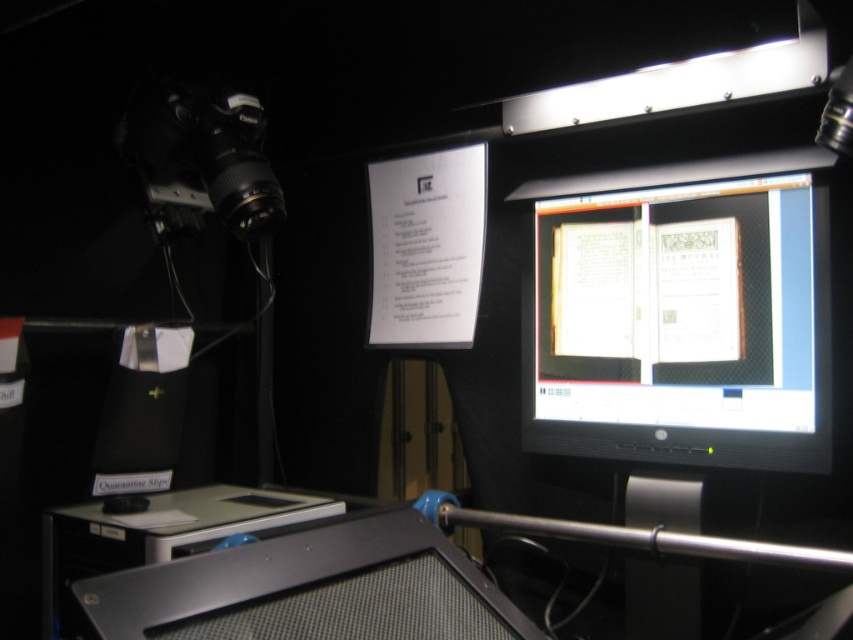
Looking at this image, you are setting up a photography studio and need to place a matte black monitor at center and a silver metallic table at lower left. Given their sizes, which object will occupy more space in the studio?

The matte black monitor at center has a larger size compared to the silver metallic table at lower left, so it will occupy more space in the studio.

You are setting up a book digitization station and need to position two markers at point (822, 448) and point (164, 508). Which marker should you place first if you want to start from the closest point to you?

You should place the marker at point (822, 448) first because it is closer to the viewer than point (164, 508) according to the description.